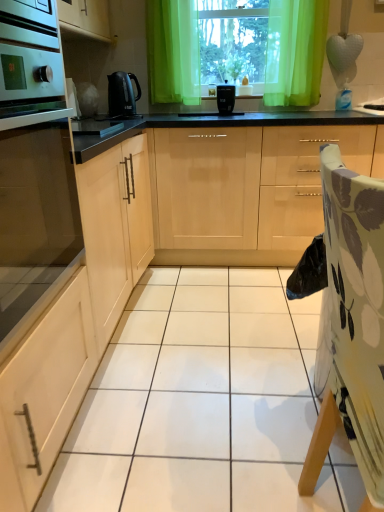
Question: Considering the relative positions of green sheer curtain at upper center and matte wood cabinet at left, the third cabinetry in the right-to-left sequence, in the image provided, is green sheer curtain at upper center to the right of matte wood cabinet at left, the third cabinetry in the right-to-left sequence, from the viewer's perspective?

Choices:
 (A) yes
 (B) no

Answer: (A)

Question: Does green sheer curtain at upper center appear on the left side of matte wood cabinet at left, the 1th cabinetry from the left?

Choices:
 (A) yes
 (B) no

Answer: (B)

Question: From a real-world perspective, is green sheer curtain at upper center below matte wood cabinet at left, the 1th cabinetry from the left?

Choices:
 (A) yes
 (B) no

Answer: (B)

Question: Can you confirm if green sheer curtain at upper center is taller than matte wood cabinet at left, the third cabinetry in the right-to-left sequence?

Choices:
 (A) no
 (B) yes

Answer: (A)

Question: Is green sheer curtain at upper center oriented towards matte wood cabinet at left, the third cabinetry in the right-to-left sequence?

Choices:
 (A) yes
 (B) no

Answer: (B)

Question: From the image's perspective, is green sheer curtain at upper center located beneath matte wood cabinet at left, the 1th cabinetry from the left?

Choices:
 (A) yes
 (B) no

Answer: (B)

Question: Can you confirm if black plastic kettle at center, positioned as the 2th kitchen appliance in right-to-left order, is bigger than floral fabric folding chair at right?

Choices:
 (A) no
 (B) yes

Answer: (A)

Question: Considering the relative sizes of black plastic kettle at center, positioned as the 2th kitchen appliance in right-to-left order, and floral fabric folding chair at right in the image provided, is black plastic kettle at center, positioned as the 2th kitchen appliance in right-to-left order, smaller than floral fabric folding chair at right?

Choices:
 (A) no
 (B) yes

Answer: (B)

Question: Is black plastic kettle at center, positioned as the 2th kitchen appliance in right-to-left order, taller than floral fabric folding chair at right?

Choices:
 (A) yes
 (B) no

Answer: (B)

Question: Is black plastic kettle at center, placed as the 1th kitchen appliance when sorted from left to right, at the right side of floral fabric folding chair at right?

Choices:
 (A) yes
 (B) no

Answer: (B)

Question: Is black plastic kettle at center, placed as the 1th kitchen appliance when sorted from left to right, completely or partially outside of floral fabric folding chair at right?

Choices:
 (A) no
 (B) yes

Answer: (B)

Question: Is floral fabric folding chair at right located within black plastic kettle at center, positioned as the 2th kitchen appliance in right-to-left order?

Choices:
 (A) no
 (B) yes

Answer: (A)

Question: Is floral fabric folding chair at right positioned beyond the bounds of matte wood cabinet at left, the 1th cabinetry from the left?

Choices:
 (A) no
 (B) yes

Answer: (B)